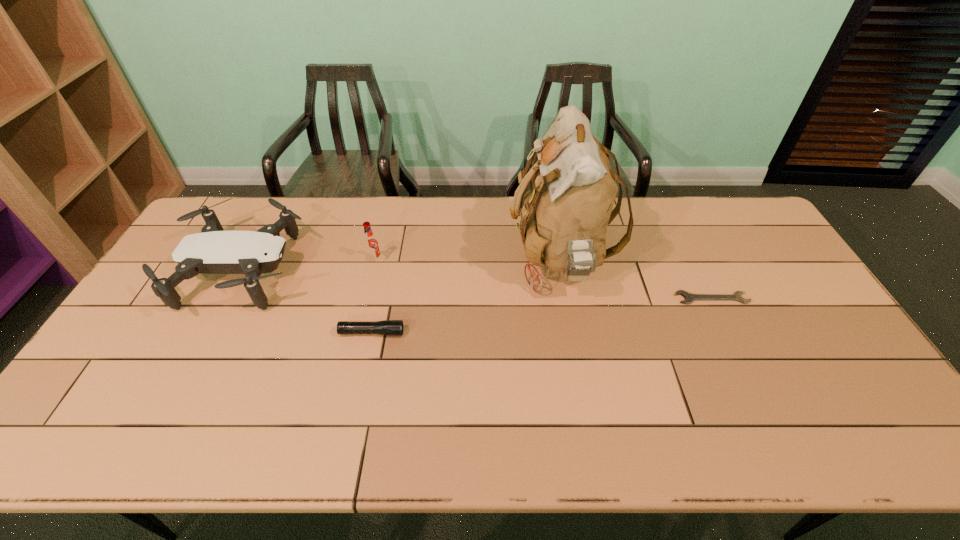
This screenshot has width=960, height=540. Find the location of `free area in between the nearest object and the drone`. free area in between the nearest object and the drone is located at coordinates tap(308, 302).

Where is `free space between the tallest object and the root beer`? This screenshot has height=540, width=960. free space between the tallest object and the root beer is located at coordinates (468, 261).

You are a GUI agent. You are given a task and a screenshot of the screen. Output one action in this format:
    pyautogui.click(x=<x>, y=<y>)
    Task: Click on the free point between the tallest object and the nearest object
    
    Given the screenshot: What is the action you would take?
    pyautogui.click(x=466, y=297)

The image size is (960, 540). Find the location of `free spot between the root beer and the rightmost object`. free spot between the root beer and the rightmost object is located at coordinates (543, 280).

In order to click on object that is the closest to the nearest object in this screenshot , I will do `click(213, 251)`.

The height and width of the screenshot is (540, 960). Identify the location of the closest object relative to the root beer. (213, 251).

The width and height of the screenshot is (960, 540). Find the location of `vacant position in the image that satisfies the following two spatial constraints: 1. on the camera side of the leftmost object; 2. on the right side of the shortest object`. vacant position in the image that satisfies the following two spatial constraints: 1. on the camera side of the leftmost object; 2. on the right side of the shortest object is located at coordinates (229, 298).

This screenshot has width=960, height=540. Find the location of `vacant space that satisfies the following two spatial constraints: 1. on the back side of the shortest object; 2. on the front-facing side of the backpack`. vacant space that satisfies the following two spatial constraints: 1. on the back side of the shortest object; 2. on the front-facing side of the backpack is located at coordinates (694, 261).

This screenshot has width=960, height=540. Identify the location of blank space that satisfies the following two spatial constraints: 1. on the front-facing side of the backpack; 2. on the right side of the shortest object. (566, 298).

Locate an element on the screen. vacant area in the image that satisfies the following two spatial constraints: 1. on the camera side of the leftmost object; 2. on the right side of the shortest object is located at coordinates (229, 298).